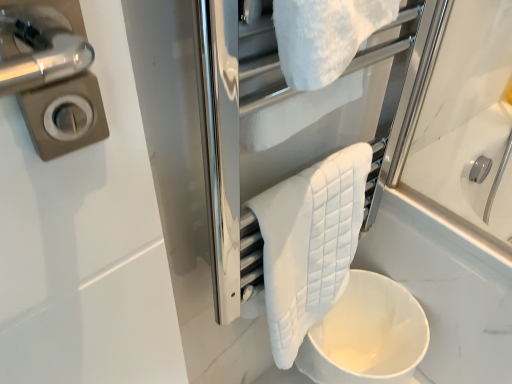
Question: Is white quilted towel at upper center in contact with white matte toilet bowl at lower center?

Choices:
 (A) no
 (B) yes

Answer: (A)

Question: Could you tell me if white quilted towel at upper center is facing white matte toilet bowl at lower center?

Choices:
 (A) yes
 (B) no

Answer: (B)

Question: Does white quilted towel at upper center have a larger size compared to white matte toilet bowl at lower center?

Choices:
 (A) no
 (B) yes

Answer: (A)

Question: From a real-world perspective, is white quilted towel at upper center physically above white matte toilet bowl at lower center?

Choices:
 (A) no
 (B) yes

Answer: (B)

Question: From a real-world perspective, is white quilted towel at upper center under white matte toilet bowl at lower center?

Choices:
 (A) no
 (B) yes

Answer: (A)

Question: From a real-world perspective, is white quilted towel at upper center above or below white matte toilet bowl at lower center?

Choices:
 (A) below
 (B) above

Answer: (B)

Question: Relative to white matte toilet bowl at lower center, is white quilted towel at upper center in front or behind?

Choices:
 (A) behind
 (B) front

Answer: (B)

Question: Considering the positions of point (271, 86) and point (395, 370), is point (271, 86) closer or farther from the camera than point (395, 370)?

Choices:
 (A) farther
 (B) closer

Answer: (B)

Question: From the image's perspective, is white quilted towel at upper center above or below white matte toilet bowl at lower center?

Choices:
 (A) below
 (B) above

Answer: (B)

Question: Would you say white matte toilet bowl at lower center is inside or outside white quilted towel at center?

Choices:
 (A) outside
 (B) inside

Answer: (A)

Question: Is white matte toilet bowl at lower center in front of or behind white quilted towel at center in the image?

Choices:
 (A) behind
 (B) front

Answer: (A)

Question: From the image's perspective, is white matte toilet bowl at lower center located above or below white quilted towel at center?

Choices:
 (A) above
 (B) below

Answer: (B)

Question: Considering the positions of white matte toilet bowl at lower center and white quilted towel at center in the image, is white matte toilet bowl at lower center taller or shorter than white quilted towel at center?

Choices:
 (A) tall
 (B) short

Answer: (B)

Question: In the image, is white quilted towel at center on the left side or the right side of white quilted towel at upper center?

Choices:
 (A) left
 (B) right

Answer: (B)

Question: From a real-world perspective, is white quilted towel at center above or below white quilted towel at upper center?

Choices:
 (A) below
 (B) above

Answer: (A)